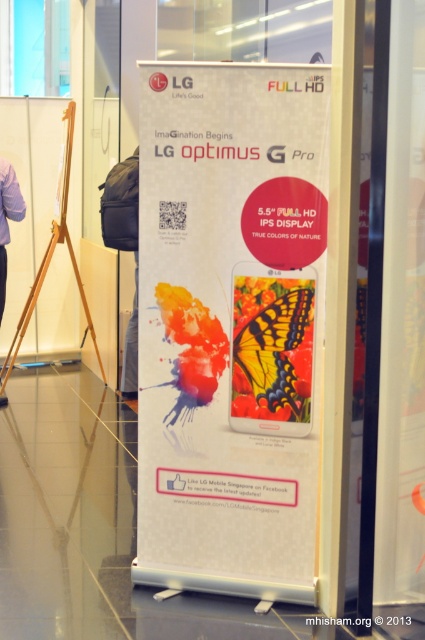
What is the relationship between the sizes of the white paper poster at center and the yellow matte butterfly at center in the display stand?

The white paper poster at center is wider than the yellow matte butterfly at center.

What is the relationship between the size of the yellow matte butterfly at center and the purple fabric at left in the promotional display?

The yellow matte butterfly at center is smaller in size compared to the purple fabric at left.